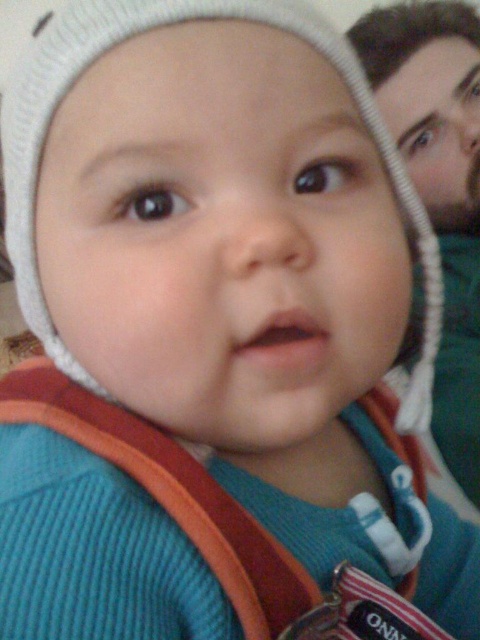
You are a photographer trying to capture a clear shot of the baby in the image. You notice two bearded men in the background. Which bearded man is closer to the camera, the bearded man at right or the bearded man at upper right?

The bearded man at right is closer to the camera because he is in front of the bearded man at upper right.

You are a photographer trying to capture both the bearded man at right and the bearded man at upper right in a single frame. Based on their widths, which one might require you to zoom out more to include fully?

The bearded man at upper right has a greater width than the bearded man at right, so you would need to zoom out more to include the bearded man at upper right fully.

You are a photographer standing in front of the bearded man at right. You want to take a portrait of him but need to maintain a safe distance of at least 3 feet. Is your current position suitable for taking the photo?

The bearded man at right and viewer are 30.53 inches apart. Since 30.53 inches is approximately 2.55 feet, which is less than the required 3 feet, the current position is not suitable for taking the photo while maintaining the safe distance.